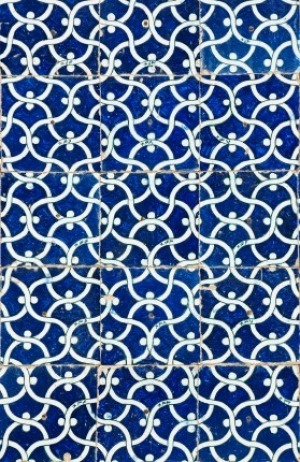
You are a GUI agent. You are given a task and a screenshot of the screen. Output one action in this format:
    pyautogui.click(x=<x>, y=<y>)
    Task: Click on the top right tile
    
    Given the screenshot: What is the action you would take?
    pyautogui.click(x=246, y=11)